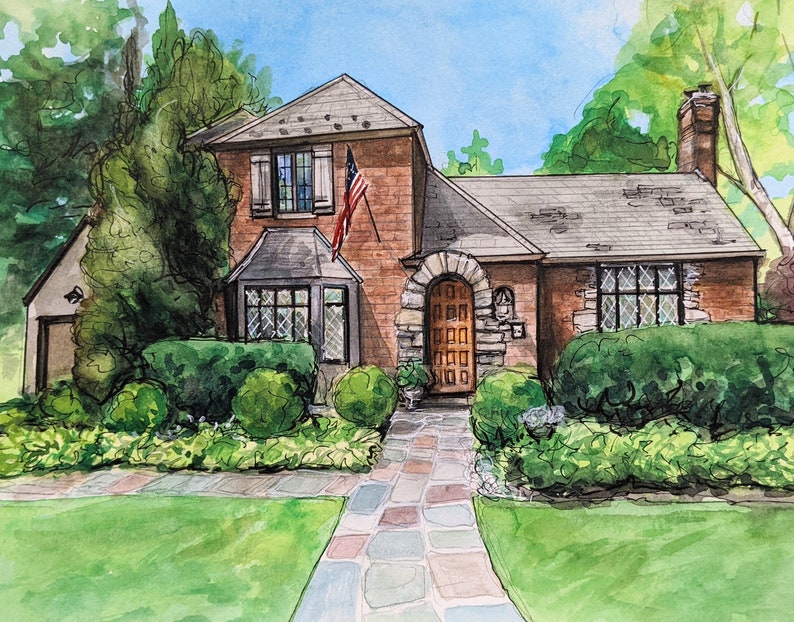
Locate an element on the screen. Image resolution: width=794 pixels, height=622 pixels. window on left is located at coordinates (283, 328).